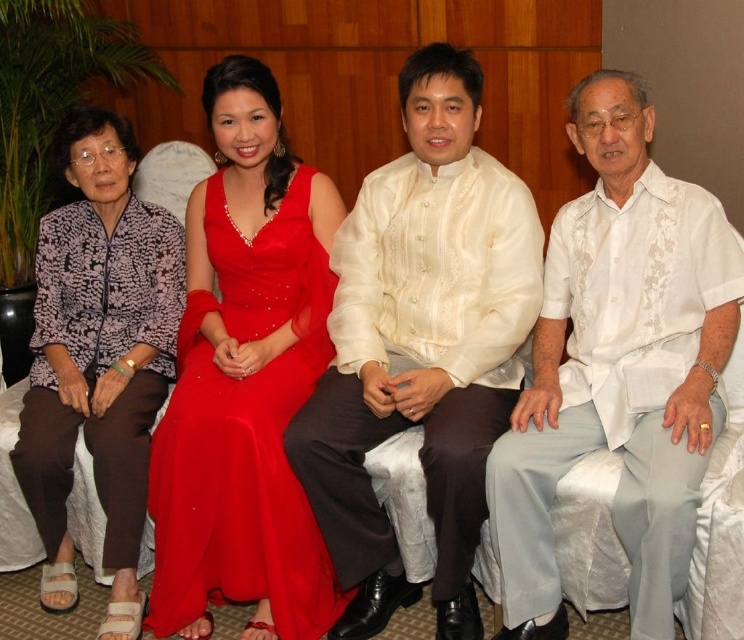
Question: Does white sheer shirt at center lie in front of white textured shirt at right?

Choices:
 (A) yes
 (B) no

Answer: (B)

Question: Which object appears farthest from the camera in this image?

Choices:
 (A) white textured shirt at right
 (B) shiny satin dress at center

Answer: (B)

Question: Among these objects, which one is nearest to the camera?

Choices:
 (A) white sheer shirt at center
 (B) white textured shirt at right
 (C) printed fabric blouse at left
 (D) shiny satin dress at center

Answer: (B)

Question: Does white sheer shirt at center appear over shiny satin dress at center?

Choices:
 (A) no
 (B) yes

Answer: (B)

Question: Which object is farther from the camera taking this photo?

Choices:
 (A) shiny satin dress at center
 (B) white sheer shirt at center
 (C) printed fabric blouse at left

Answer: (C)

Question: Can you confirm if white sheer shirt at center is positioned above shiny satin dress at center?

Choices:
 (A) yes
 (B) no

Answer: (A)